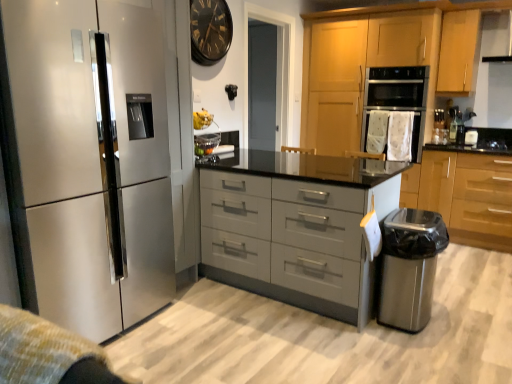
Question: Should I look upward or downward to see stainless steel trash can at lower right, placed as the 2th appliance when sorted from back to front?

Choices:
 (A) up
 (B) down

Answer: (B)

Question: Should I look upward or downward to see satin metallic refrigerator at left?

Choices:
 (A) down
 (B) up

Answer: (A)

Question: Is satin wood cabinet at lower right, positioned as the first cabinetry in right-to-left order, with satin metallic refrigerator at left?

Choices:
 (A) no
 (B) yes

Answer: (A)

Question: Considering the relative sizes of satin wood cabinet at lower right, positioned as the first cabinetry in right-to-left order, and satin metallic refrigerator at left in the image provided, is satin wood cabinet at lower right, positioned as the first cabinetry in right-to-left order, bigger than satin metallic refrigerator at left?

Choices:
 (A) no
 (B) yes

Answer: (B)

Question: From the image's perspective, is satin wood cabinet at lower right, the third cabinetry in the left-to-right sequence, on satin metallic refrigerator at left?

Choices:
 (A) no
 (B) yes

Answer: (B)

Question: Is the position of satin wood cabinet at lower right, positioned as the first cabinetry in right-to-left order, more distant than that of satin metallic refrigerator at left?

Choices:
 (A) yes
 (B) no

Answer: (A)

Question: Is satin metallic refrigerator at left a part of satin wood cabinet at lower right, the third cabinetry in the left-to-right sequence?

Choices:
 (A) yes
 (B) no

Answer: (B)

Question: Can you confirm if satin wood cabinet at lower right, positioned as the first cabinetry in right-to-left order, is positioned to the left of satin metallic refrigerator at left?

Choices:
 (A) no
 (B) yes

Answer: (A)

Question: Are satin grey drawers at center and white fabric oven at center beside each other?

Choices:
 (A) yes
 (B) no

Answer: (B)

Question: Is satin grey drawers at center closer to camera compared to white fabric oven at center?

Choices:
 (A) yes
 (B) no

Answer: (A)

Question: Is satin grey drawers at center not inside white fabric oven at center?

Choices:
 (A) no
 (B) yes

Answer: (B)

Question: From the image's perspective, is satin grey drawers at center under white fabric oven at center?

Choices:
 (A) no
 (B) yes

Answer: (B)

Question: Can you confirm if satin grey drawers at center is thinner than white fabric oven at center?

Choices:
 (A) no
 (B) yes

Answer: (A)

Question: Is satin grey drawers at center oriented away from white fabric oven at center?

Choices:
 (A) yes
 (B) no

Answer: (A)

Question: Can you confirm if satin grey drawers at center is smaller than black glass clock at upper center?

Choices:
 (A) yes
 (B) no

Answer: (B)